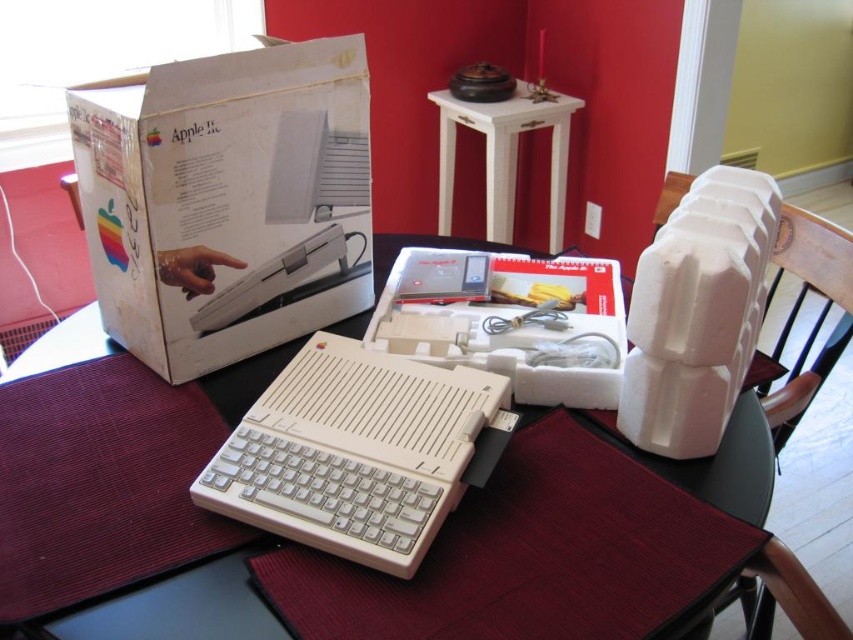
You have a small toy car that is 3 inches long. You want to move it from the white cardboard box at upper left to the white plastic table at center. Is there enough space between them for the toy car to move freely?

The white cardboard box at upper left and white plastic table at center are 6.89 inches apart from each other. Since the toy car is only 3 inches long, there is sufficient space for it to move freely between them.

You are setting up the vintage Apple II computer and need to place the accessories from the open box on the right to the left side of the white plastic computer at center. Can you confirm the direction you should move the accessories relative to the computer?

The white plastic computer at center is located at point (x=357, y=451). Since the open box with accessories is on the right side of the table, you should move the accessories to the left side relative to the computer to place them to the left of it.

You are standing in front of the vintage Apple II computer setup. There are two points marked on the table. One is at coordinates point (285, 513) and the other is at point (509, 204). Which point is closer to you?

Point (285, 513) is closer to the viewer than point (509, 204).